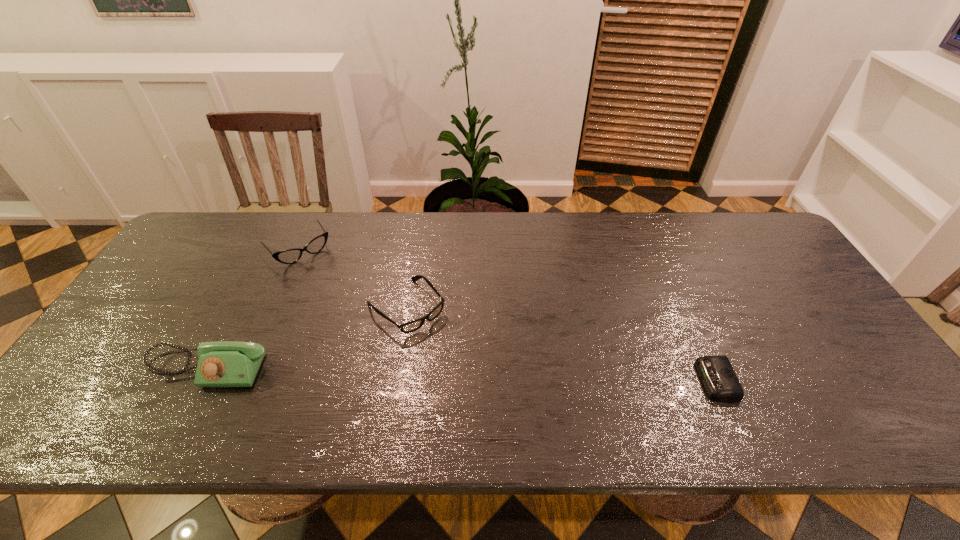
At what (x,y) coordinates should I click in order to perform the action: click on object that is at the near left corner. Please return your answer as a coordinate pair (x, y). The width and height of the screenshot is (960, 540). Looking at the image, I should click on (224, 363).

The image size is (960, 540). I want to click on vacant space at the far edge of the desktop, so click(454, 215).

The width and height of the screenshot is (960, 540). Identify the location of vacant space at the near edge. (145, 395).

Identify the location of vacant space at the right edge of the desktop. Image resolution: width=960 pixels, height=540 pixels. (762, 259).

The image size is (960, 540). Find the location of `vacant position at the far left corner of the desktop`. vacant position at the far left corner of the desktop is located at coordinates (238, 235).

Image resolution: width=960 pixels, height=540 pixels. Find the location of `free region at the near left corner`. free region at the near left corner is located at coordinates coord(128,401).

Where is `vacant space at the far right corner of the desktop`? This screenshot has height=540, width=960. vacant space at the far right corner of the desktop is located at coordinates (752, 224).

Where is `vacant area that lies between the farther spectacles and the shortest object`? The height and width of the screenshot is (540, 960). vacant area that lies between the farther spectacles and the shortest object is located at coordinates (508, 315).

Find the location of a particular element. free area in between the tallest object and the farther spectacles is located at coordinates (253, 309).

Image resolution: width=960 pixels, height=540 pixels. Identify the location of unoccupied position between the nearer spectacles and the telephone. (306, 338).